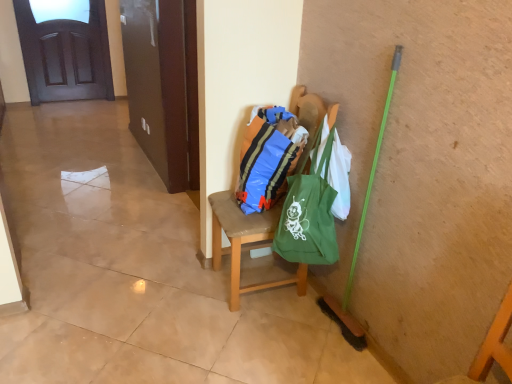
This screenshot has height=384, width=512. Identify the location of free space in front of green fabric bag at center. (261, 339).